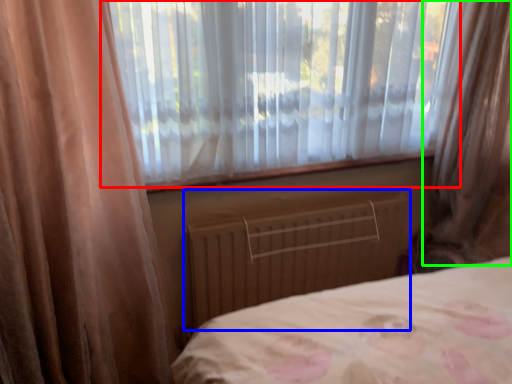
Question: Which object is positioned closest to window (highlighted by a red box)? Select from radiator (highlighted by a blue box) and curtain (highlighted by a green box).

Choices:
 (A) radiator
 (B) curtain

Answer: (A)